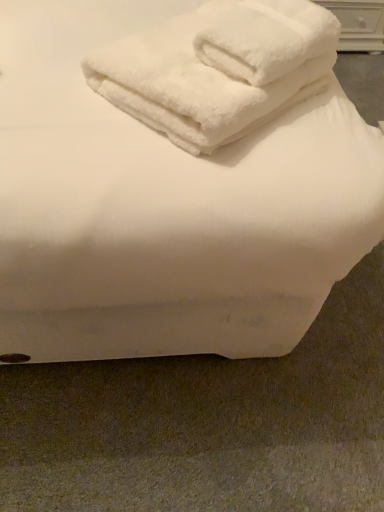
Find the location of a particular element. white fluffy towels at upper center is located at coordinates (218, 69).

Describe the element at coordinates (218, 69) in the screenshot. This screenshot has width=384, height=512. I see `white fluffy towels at upper center` at that location.

Measure the distance between point (177, 73) and camera.

Point (177, 73) and camera are 30.04 inches apart.

Describe the element at coordinates (358, 23) in the screenshot. I see `white wood drawer at upper right` at that location.

Identify the location of white wood drawer at upper right. (358, 23).

Locate an element on the screen. The height and width of the screenshot is (512, 384). white fluffy towels at upper center is located at coordinates (218, 69).

Which is more to the left, white wood drawer at upper right or white fluffy towels at upper center?

white fluffy towels at upper center.

Considering the positions of objects white wood drawer at upper right and white fluffy towels at upper center in the image provided, who is in front, white wood drawer at upper right or white fluffy towels at upper center?

white fluffy towels at upper center.

Is point (340, 47) in front of point (141, 50)?

No, (340, 47) is behind (141, 50).

From the image's perspective, between white wood drawer at upper right and white fluffy towels at upper center, who is located below?

From the image's view, white fluffy towels at upper center is below.

From a real-world perspective, between white wood drawer at upper right and white fluffy towels at upper center, who is vertically lower?

In real-world perspective, white wood drawer at upper right is lower.

Consider the image. Is white wood drawer at upper right wider or thinner than white fluffy towels at upper center?

Clearly, white wood drawer at upper right has less width compared to white fluffy towels at upper center.

Does white wood drawer at upper right have a greater height compared to white fluffy towels at upper center?

Correct, white wood drawer at upper right is much taller as white fluffy towels at upper center.

Is white wood drawer at upper right smaller than white fluffy towels at upper center?

Incorrect, white wood drawer at upper right is not smaller in size than white fluffy towels at upper center.

Looking at this image, is white wood drawer at upper right not inside white fluffy towels at upper center?

Yes.

Is white wood drawer at upper right not close to white fluffy towels at upper center?

Indeed, white wood drawer at upper right is not near white fluffy towels at upper center.

Is white wood drawer at upper right facing towards white fluffy towels at upper center?

No, white wood drawer at upper right is not aimed at white fluffy towels at upper center.

Consider the image. How many degrees apart are the facing directions of white wood drawer at upper right and white fluffy towels at upper center?

There is a 50.3-degree angle between the facing directions of white wood drawer at upper right and white fluffy towels at upper center.

What are the coordinates of `towel lying below the white wood drawer at upper right (from the image's perspective)` in the screenshot? It's located at (218, 69).

Does white fluffy towels at upper center appear on the right side of white wood drawer at upper right?

In fact, white fluffy towels at upper center is to the left of white wood drawer at upper right.

Consider the image. Is white fluffy towels at upper center in front of white wood drawer at upper right?

That is True.

Does point (291, 34) come behind point (368, 23)?

No, (291, 34) is in front of (368, 23).

From the image's perspective, between white fluffy towels at upper center and white wood drawer at upper right, which one is located above?

From the image's view, white wood drawer at upper right is above.

From a real-world perspective, is white fluffy towels at upper center below white wood drawer at upper right?

No, from a real-world perspective, white fluffy towels at upper center is not under white wood drawer at upper right.

Which object is wider, white fluffy towels at upper center or white wood drawer at upper right?

white fluffy towels at upper center is wider.

Considering the sizes of objects white fluffy towels at upper center and white wood drawer at upper right in the image provided, who is taller, white fluffy towels at upper center or white wood drawer at upper right?

white wood drawer at upper right is taller.

Is white fluffy towels at upper center bigger or smaller than white wood drawer at upper right?

Considering their sizes, white fluffy towels at upper center takes up less space than white wood drawer at upper right.

Is white fluffy towels at upper center outside of white wood drawer at upper right?

white fluffy towels at upper center lies outside white wood drawer at upper right's area.

Is white fluffy towels at upper center far from white wood drawer at upper right?

white fluffy towels at upper center is positioned a significant distance from white wood drawer at upper right.

Is white fluffy towels at upper center looking in the opposite direction of white wood drawer at upper right?

No.

Locate an element on the screen. The height and width of the screenshot is (512, 384). drawer that appears below the white fluffy towels at upper center (from a real-world perspective) is located at coordinates (358, 23).

Locate an element on the screen. towel lying in front of the white wood drawer at upper right is located at coordinates (218, 69).

In the image, there is a white fluffy towels at upper center. Where is `drawer above it (from the image's perspective)`? The width and height of the screenshot is (384, 512). drawer above it (from the image's perspective) is located at coordinates 358,23.